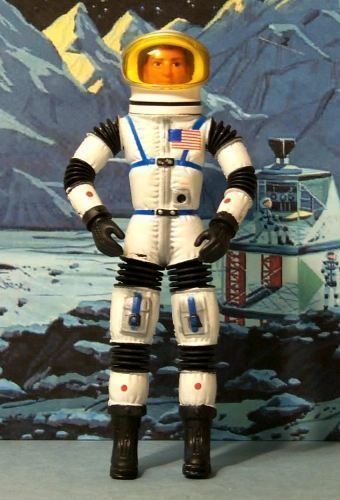
Locate an element on the screen. The image size is (340, 500). chair is located at coordinates (267, 232).